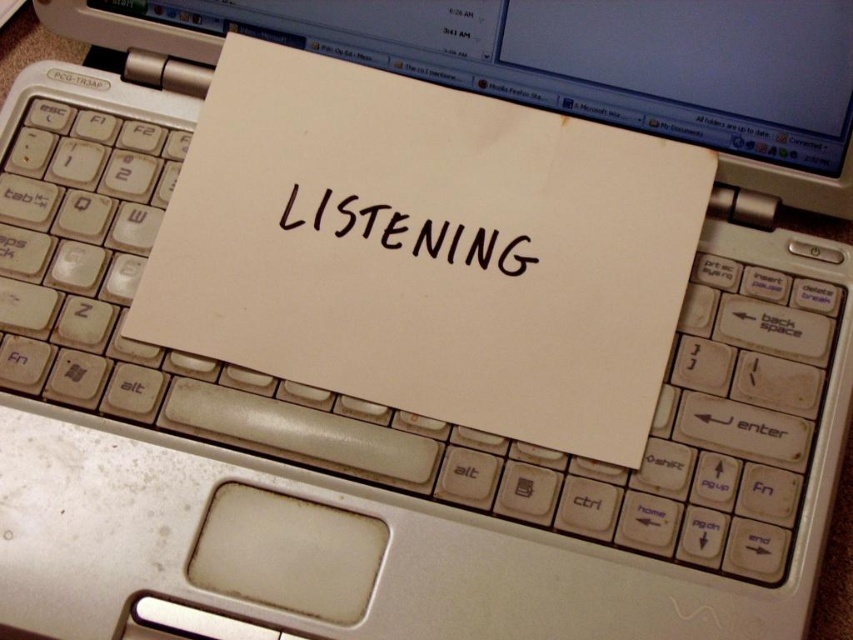
Between white paper at center and black handwritten text at center, which one appears on the left side from the viewer's perspective?

Positioned to the left is black handwritten text at center.

Who is more distant from viewer, (x=619, y=268) or (x=296, y=195)?

Point (x=296, y=195)

Image resolution: width=853 pixels, height=640 pixels. What are the coordinates of `white paper at center` in the screenshot? It's located at (427, 250).